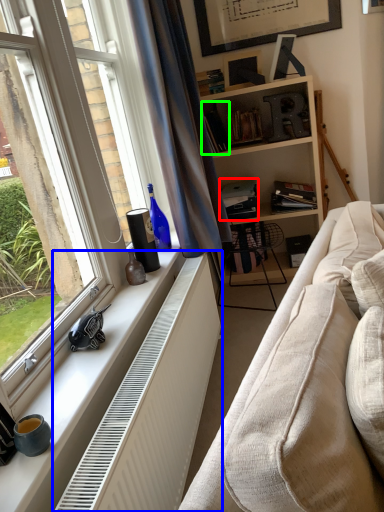
Question: Estimate the real-world distances between objects in this image. Which object is farther from book (highlighted by a red box), radiator (highlighted by a blue box) or book (highlighted by a green box)?

Choices:
 (A) radiator
 (B) book

Answer: (A)